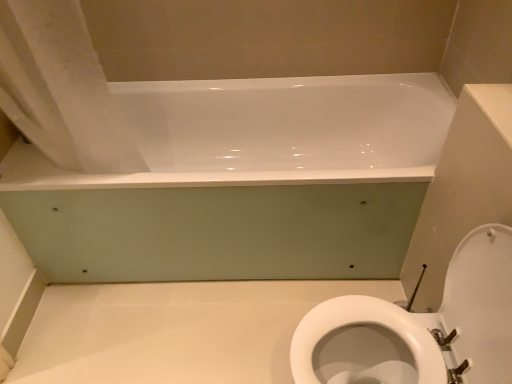
Question: From a real-world perspective, is white glossy bathtub at upper center physically located above or below white fabric shower curtain at upper left?

Choices:
 (A) above
 (B) below

Answer: (B)

Question: Is white glossy bathtub at upper center inside or outside of white fabric shower curtain at upper left?

Choices:
 (A) inside
 (B) outside

Answer: (B)

Question: Which object is the farthest from the white fabric shower curtain at upper left?

Choices:
 (A) white glossy toilet at lower right
 (B) white glossy bathtub at upper center

Answer: (A)

Question: Considering the real-world distances, which object is closest to the white glossy toilet at lower right?

Choices:
 (A) white fabric shower curtain at upper left
 (B) white glossy bathtub at upper center

Answer: (B)